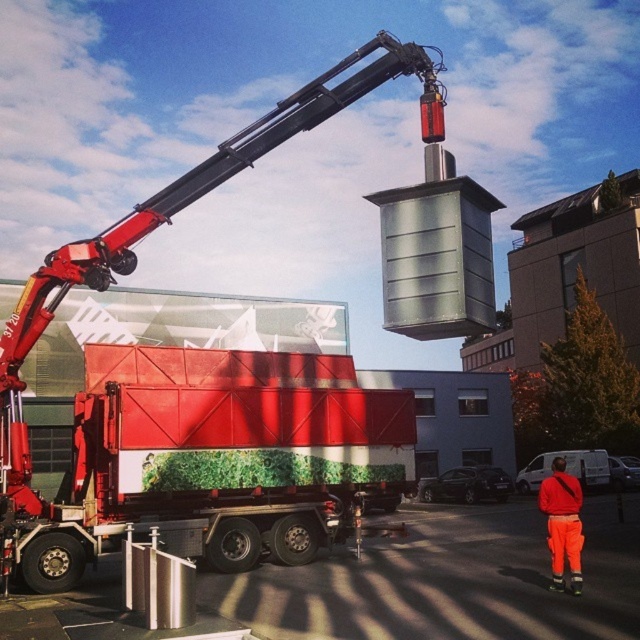
Question: Can you confirm if red matte trailer truck at center is smaller than orange reflective pants at lower right?

Choices:
 (A) yes
 (B) no

Answer: (B)

Question: Is red matte trailer truck at center to the left of orange reflective pants at lower right from the viewer's perspective?

Choices:
 (A) no
 (B) yes

Answer: (B)

Question: Is red matte trailer truck at center above orange reflective pants at lower right?

Choices:
 (A) yes
 (B) no

Answer: (A)

Question: Among these points, which one is nearest to the camera?

Choices:
 (A) (556, 490)
 (B) (298, 426)

Answer: (A)